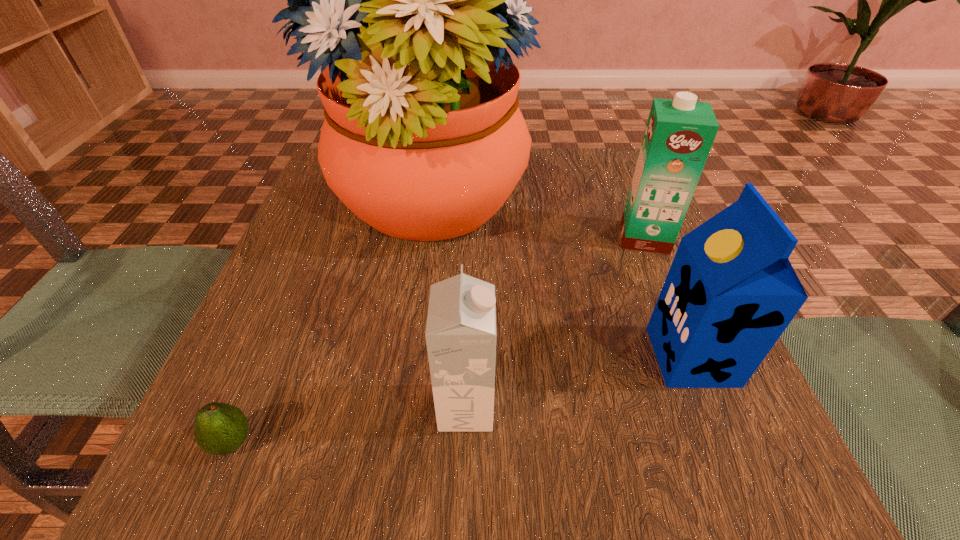
Where is `flower arrangement`? The width and height of the screenshot is (960, 540). flower arrangement is located at coordinates (408, 0).

The width and height of the screenshot is (960, 540). I want to click on the farthest carton, so click(x=679, y=134).

Locate an element on the screen. The height and width of the screenshot is (540, 960). the leftmost carton is located at coordinates (460, 334).

Image resolution: width=960 pixels, height=540 pixels. Identify the location of the shortest object. (219, 429).

Where is `free spot located on the front of the tallest object`? The image size is (960, 540). free spot located on the front of the tallest object is located at coordinates (395, 402).

Where is `free space located on the back of the farthest carton`? The height and width of the screenshot is (540, 960). free space located on the back of the farthest carton is located at coordinates (613, 164).

This screenshot has height=540, width=960. Find the location of `blank space located on the front label of the leftmost carton`. blank space located on the front label of the leftmost carton is located at coordinates (691, 407).

Locate an element on the screen. The height and width of the screenshot is (540, 960). vacant area situated on the back of the shortest object is located at coordinates (267, 360).

The height and width of the screenshot is (540, 960). Identify the location of object that is positioned at the far edge. (408, 0).

I want to click on object that is at the near edge, so tap(219, 429).